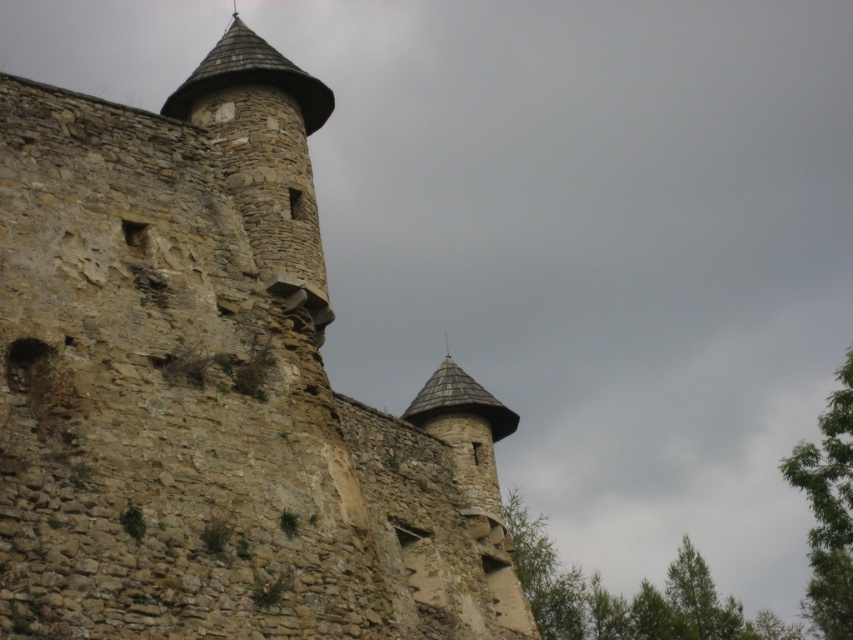
Question: Based on their relative distances, which object is farther from the rustic stone tower at upper left?

Choices:
 (A) green leafy tree at right
 (B) green leafy tree at upper center

Answer: (B)

Question: Is rustic stone tower at upper left wider than green leafy tree at right?

Choices:
 (A) yes
 (B) no

Answer: (B)

Question: Is the position of green leafy tree at upper center less distant than that of green leafy tree at right?

Choices:
 (A) no
 (B) yes

Answer: (A)

Question: Does rustic stone tower at upper left appear under green leafy tree at right?

Choices:
 (A) yes
 (B) no

Answer: (B)

Question: Which object appears farthest from the camera in this image?

Choices:
 (A) green leafy tree at right
 (B) rustic stone tower at upper left

Answer: (A)

Question: Which object appears closest to the camera in this image?

Choices:
 (A) rustic stone tower at upper left
 (B) green leafy tree at upper center

Answer: (A)